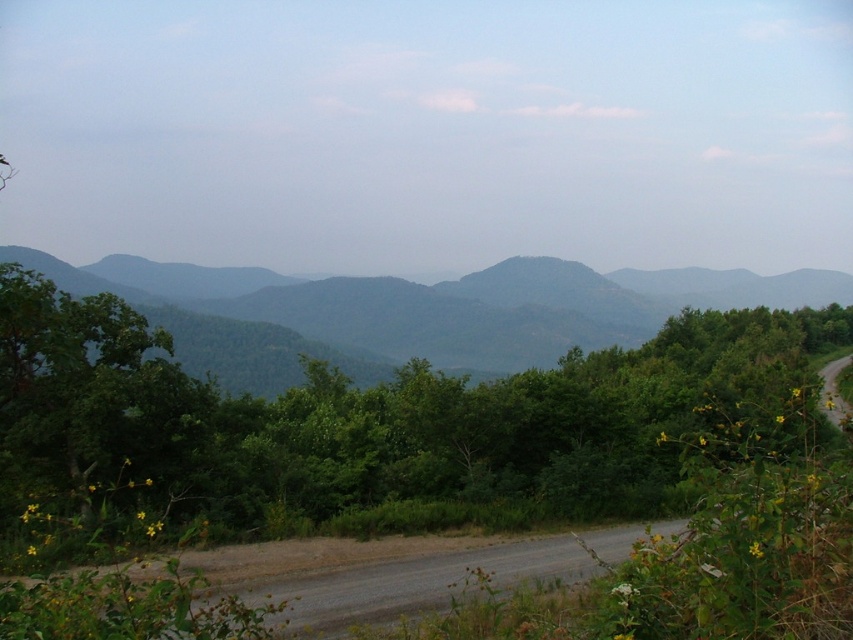
Question: Can you confirm if green leafy tree at center is positioned below green forested mountain at center?

Choices:
 (A) no
 (B) yes

Answer: (B)

Question: Is green leafy tree at center smaller than green forested mountain at center?

Choices:
 (A) no
 (B) yes

Answer: (B)

Question: Among these points, which one is nearest to the camera?

Choices:
 (A) 753,301
 (B) 596,467

Answer: (B)

Question: Does green leafy tree at center appear over green forested mountain at center?

Choices:
 (A) yes
 (B) no

Answer: (B)

Question: Which of the following is the closest to the observer?

Choices:
 (A) (177, 493)
 (B) (521, 355)

Answer: (A)